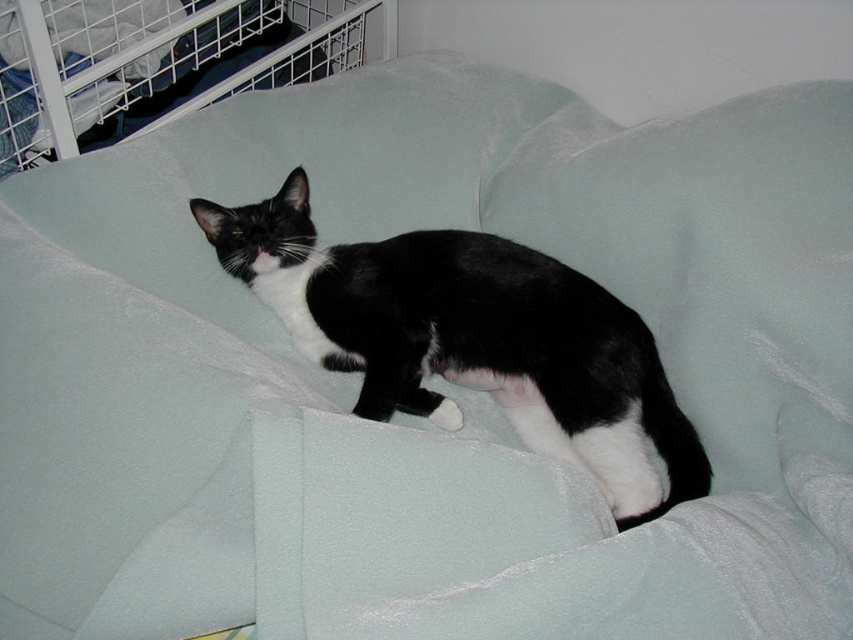
Question: Which point is farther from the camera taking this photo?

Choices:
 (A) (241, 68)
 (B) (463, 364)

Answer: (A)

Question: Is black fur cat at center below brushed metal cage at upper left?

Choices:
 (A) no
 (B) yes

Answer: (B)

Question: Does black fur cat at center have a larger size compared to brushed metal cage at upper left?

Choices:
 (A) yes
 (B) no

Answer: (B)

Question: Does black fur cat at center appear on the left side of brushed metal cage at upper left?

Choices:
 (A) no
 (B) yes

Answer: (A)